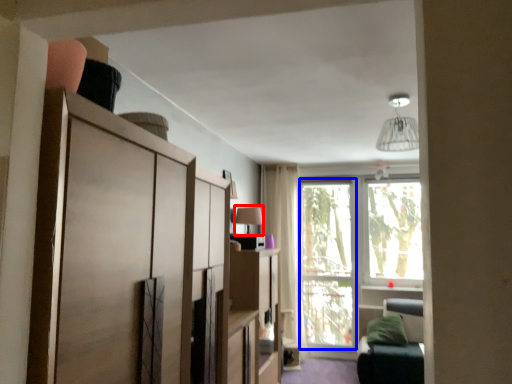
Question: Which point is further to the camera, lamp (highlighted by a red box) or window screen (highlighted by a blue box)?

Choices:
 (A) lamp
 (B) window screen

Answer: (B)